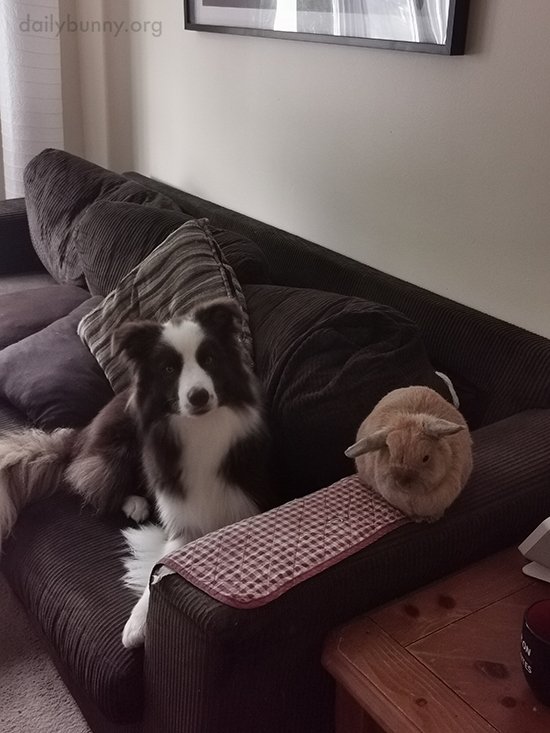
The width and height of the screenshot is (550, 733). Find the location of `sofa`. sofa is located at coordinates (267, 528), (280, 278).